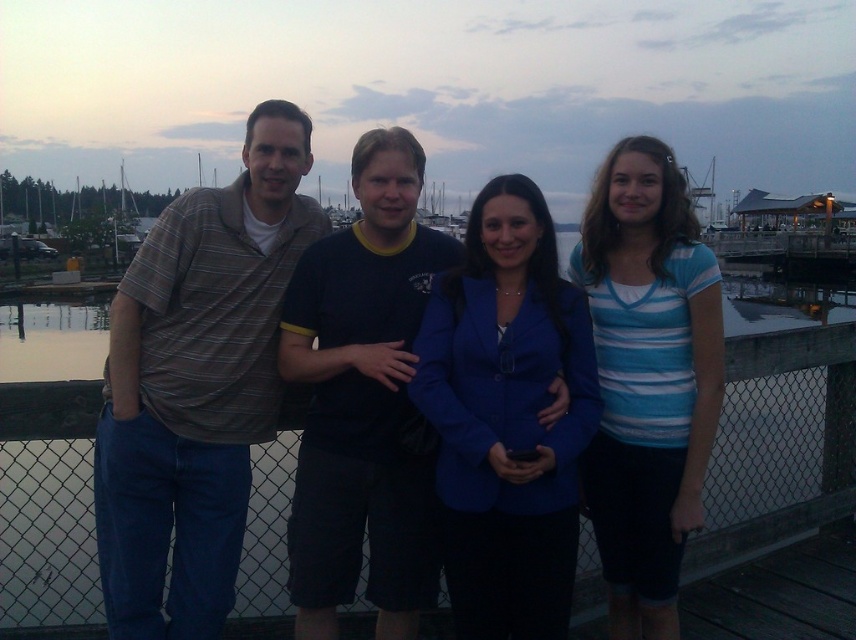
You are standing at the point with coordinates point (399, 161) and want to walk towards the point with coordinates point (138, 604). Which direction should you move?

You should move forward because point (138, 604) is in front of point (399, 161).